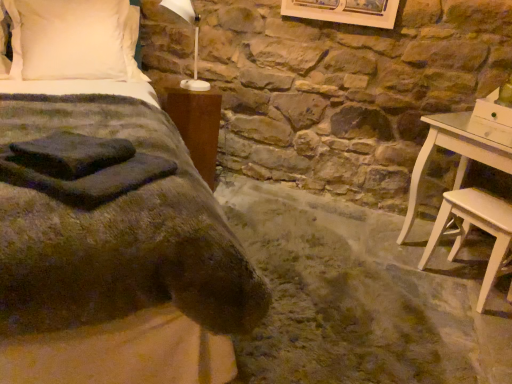
I want to click on free space in front of light wood stool at lower right, so click(x=475, y=327).